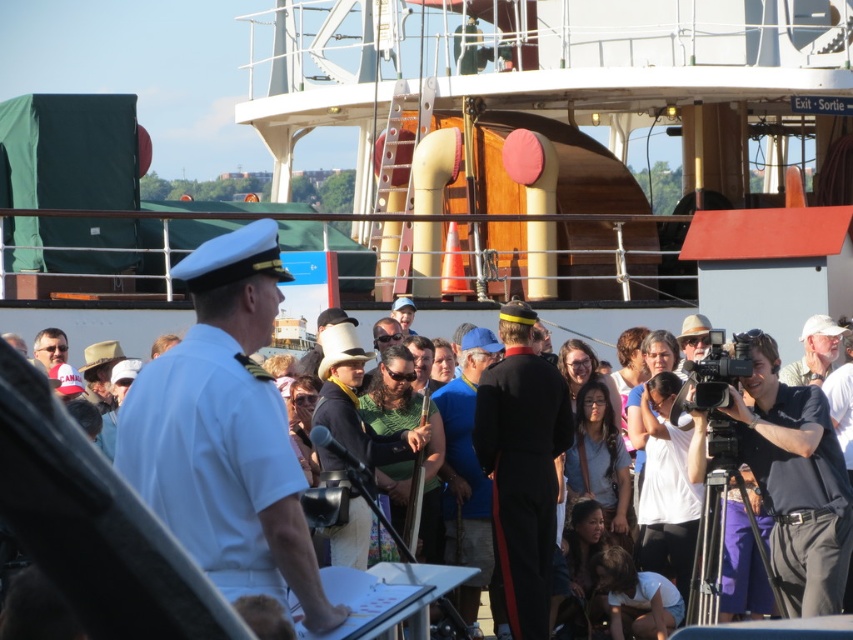
You are a photographer at the event and need to capture a photo of both the black uniform at center and the green fabric shirt at center. Which one is on the right side when facing the crowd?

The black uniform at center is positioned on the right side of green fabric shirt at center, so when facing the crowd, the black uniform at center is on the right side.

In the scene shown: You are a photographer positioned at the back of the crowd. You want to take a photo of the man at the podium. Which object, the white uniform at center or the matte white cap at center, will appear larger in your photo?

The white uniform at center will appear larger in the photo because it is closer to the viewer than the matte white cap at center.

You are a photographer at the event and need to capture both the black uniform at center and the gray fabric cap at right in a single frame. Since your camera has a limited zoom, you can only adjust your distance to the subjects. Which subject should you move closer to in order to ensure both are in focus?

You should move closer to the black uniform at center because it is larger than the gray fabric cap at right, so keeping it in focus requires being nearer to it.